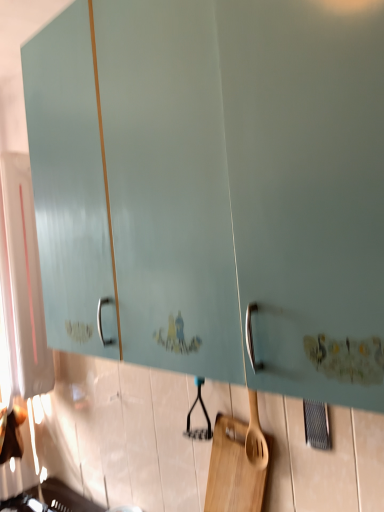
What is the approximate width of wooden cutting board at center?

3.38 inches.

Describe the element at coordinates (234, 470) in the screenshot. I see `wooden cutting board at center` at that location.

What is the approximate height of wooden cutting board at center?

wooden cutting board at center is 12.33 inches in height.

The height and width of the screenshot is (512, 384). I want to click on wooden cutting board at center, so pyautogui.click(x=234, y=470).

Find the location of a particular element. Image resolution: width=384 pixels, height=512 pixels. wooden cutting board at center is located at coordinates (234, 470).